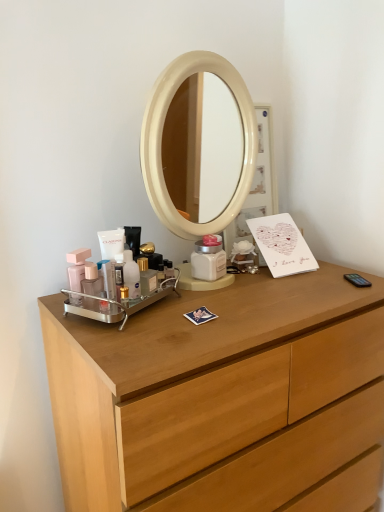
Question: Is light wood chest of drawers at center taller or shorter than translucent plastic bottle at center, placed as the fourth toiletry when sorted from left to right?

Choices:
 (A) short
 (B) tall

Answer: (B)

Question: Based on their positions, is light wood chest of drawers at center located to the left or right of translucent plastic bottle at center, placed as the fourth toiletry when sorted from left to right?

Choices:
 (A) right
 (B) left

Answer: (A)

Question: Estimate the real-world distances between objects in this image. Which object is farther from the light wood chest of drawers at center?

Choices:
 (A) translucent plastic bottle at center, placed as the fourth toiletry when sorted from left to right
 (B) matte pink bottle at left, the second toiletry from the left
 (C) translucent plastic tube at center, the second toiletry viewed from the right
 (D) matte pink plastic at left, arranged as the first toiletry when viewed from the left

Answer: (D)

Question: Which of these objects is positioned closest to the matte pink plastic at left, arranged as the first toiletry when viewed from the left?

Choices:
 (A) translucent plastic bottle at center, placed as the fourth toiletry when sorted from left to right
 (B) translucent plastic tube at center, the second toiletry viewed from the right
 (C) matte pink bottle at left, the 3th toiletry in the right-to-left sequence
 (D) light wood chest of drawers at center

Answer: (C)